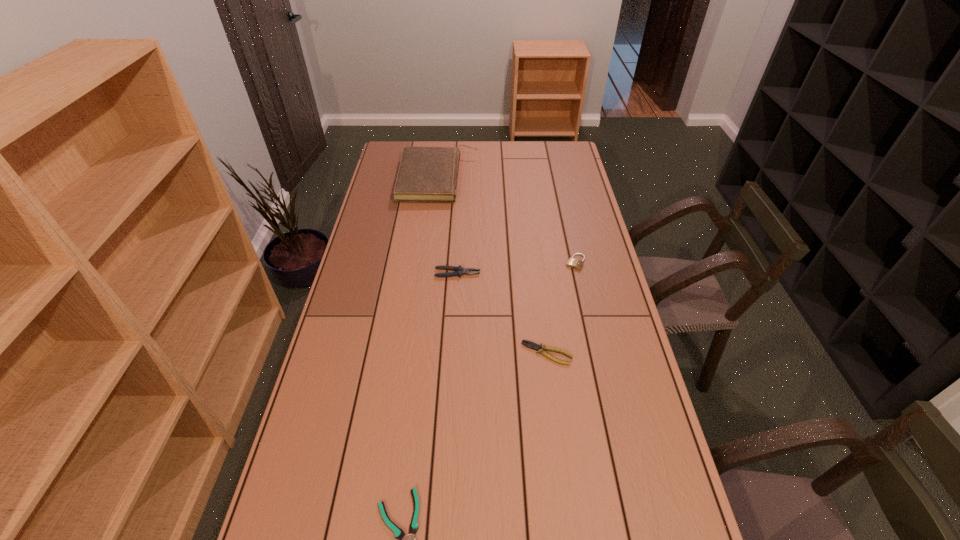
Identify the location of vacant space located 0.180m on the front of the second tallest pliers. The image size is (960, 540). (556, 424).

This screenshot has width=960, height=540. Find the location of `object located in the far edge section of the desktop`. object located in the far edge section of the desktop is located at coordinates (426, 174).

Where is `object present at the left edge`? object present at the left edge is located at coordinates (426, 174).

Image resolution: width=960 pixels, height=540 pixels. Find the location of `object that is at the right edge`. object that is at the right edge is located at coordinates (573, 263).

At what (x,y) coordinates should I click in order to perform the action: click on object present at the far left corner. Please return your answer as a coordinate pair (x, y). The image size is (960, 540). Looking at the image, I should click on (426, 174).

At what (x,y) coordinates should I click in order to perform the action: click on vacant space at the far edge. Please return your answer as a coordinate pair (x, y). The height and width of the screenshot is (540, 960). Looking at the image, I should click on (504, 157).

The width and height of the screenshot is (960, 540). I want to click on vacant space at the left edge, so click(x=342, y=536).

In the image, there is a desktop. Identify the location of blank space at the right edge. This screenshot has height=540, width=960. (654, 415).

This screenshot has width=960, height=540. I want to click on vacant area that lies between the tallest object and the farthest pliers, so click(x=448, y=226).

Find the location of `free space that is in between the rightmost pliers and the second tallest object`. free space that is in between the rightmost pliers and the second tallest object is located at coordinates (502, 313).